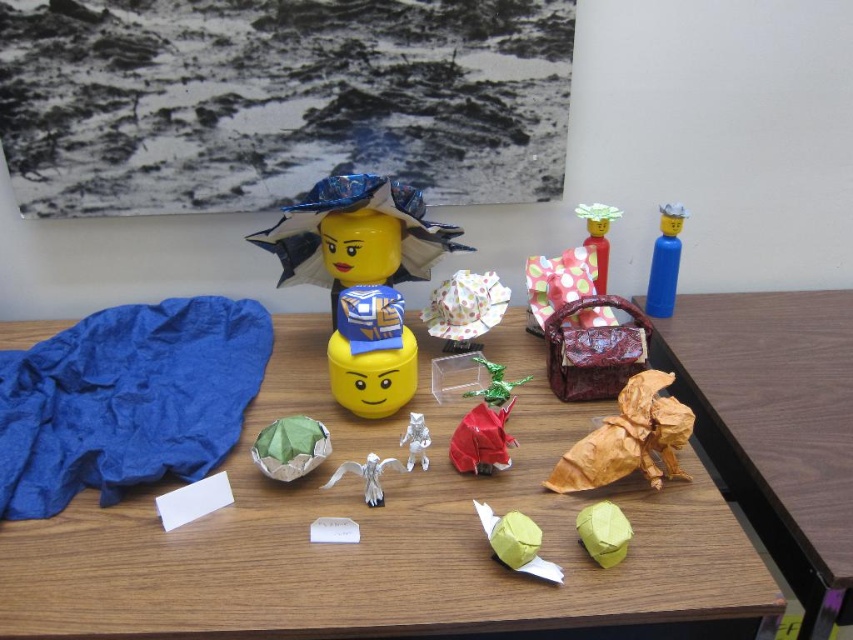
You are organizing a craft fair and need to place a new item between the polka dot paper bag at center and the white paper angel at center. The item you want to place is 22 centimeters wide. Will there be enough space between them to fit this item?

The polka dot paper bag at center and white paper angel at center are 44.82 centimeters apart. Since the item you want to place is 22 centimeters wide, there is enough space between them to fit the item.

You are a delivery robot that needs to place a small package on the table. The package must be placed exactly at the center of the table. You see the polka dot paper bag at center. Can you use its position to determine if you are currently aligned with the table center?

The polka dot paper bag at center is located at point (558, 282), which is not exactly the center of the table. Therefore, you are not currently aligned with the table center and need to adjust your position to reach the true center.

You are an artist planning to place a new sculpture on the table. The new sculpture is 10 cm tall. You want to ensure it doesn not block the view of the gold paper sculpture at right and the metallic green dragon at center. Can you place it anywhere on the table without covering either of them?

The gold paper sculpture at right is taller than the metallic green dragon at center. Since your new sculpture is 10 cm tall, you can place it anywhere on the table except directly in front of or overlapping with the gold paper sculpture at right and the metallic green dragon at center to ensure they remain visible.